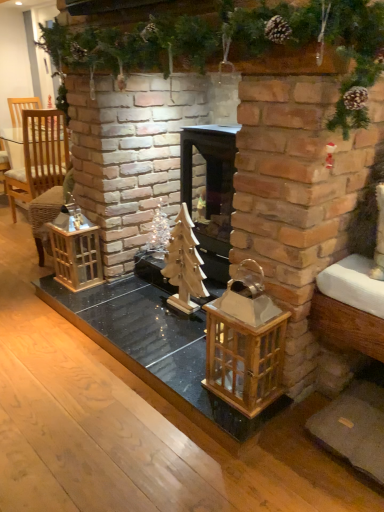
Question: From the image's perspective, is wooden christmas tree at center above or below black wood fireplace at center?

Choices:
 (A) below
 (B) above

Answer: (A)

Question: Does point (193, 307) appear closer or farther from the camera than point (231, 154)?

Choices:
 (A) closer
 (B) farther

Answer: (B)

Question: Considering the real-world distances, which object is farthest from the wooden christmas tree at center?

Choices:
 (A) black wood fireplace at center
 (B) wooden lantern at left, arranged as the 1th cage when viewed from the left
 (C) wooden christmas tree at center
 (D) wooden lantern at center, which ranks as the first cage in front-to-back order
 (E) woven wicker armchair at left

Answer: (E)

Question: Estimate the real-world distances between objects in this image. Which object is closer to the wooden christmas tree at center?

Choices:
 (A) wooden lantern at left, the 1th cage viewed from the back
 (B) wooden christmas tree at center
 (C) black wood fireplace at center
 (D) woven wicker armchair at left
 (E) wooden lantern at center, the 2th cage in the back-to-front sequence

Answer: (C)